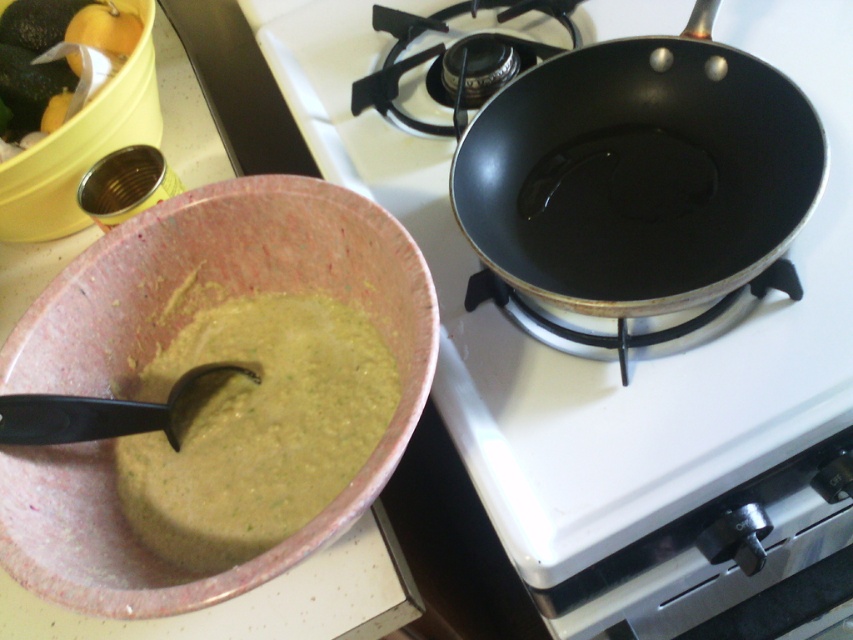
Between black matte pan at upper right and green matte avocado at upper left, which one appears on the right side from the viewer's perspective?

From the viewer's perspective, black matte pan at upper right appears more on the right side.

What do you see at coordinates (628, 360) in the screenshot?
I see `black matte pan at upper right` at bounding box center [628, 360].

Locate an element on the screen. The width and height of the screenshot is (853, 640). black matte pan at upper right is located at coordinates (628, 360).

Can you confirm if black matte pan at upper right is smaller than black plastic spoon at lower left?

No, black matte pan at upper right is not smaller than black plastic spoon at lower left.

This screenshot has width=853, height=640. I want to click on black matte pan at upper right, so click(628, 360).

Does point (602, 548) come farther from viewer compared to point (67, 404)?

Yes.

Identify the location of black matte pan at upper right. (628, 360).

The image size is (853, 640). In order to click on pink speckled bowl at lower left in this screenshot , I will do `click(164, 342)`.

Who is more distant from viewer, (146, 563) or (722, 214)?

The point (722, 214) is more distant.

The width and height of the screenshot is (853, 640). I want to click on pink speckled bowl at lower left, so click(164, 342).